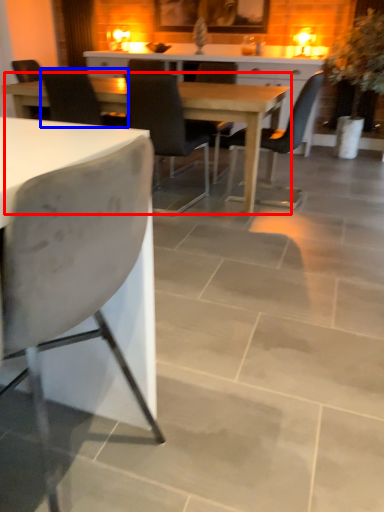
Question: Which point is further to the camera, kitchen & dining room table (highlighted by a red box) or chair (highlighted by a blue box)?

Choices:
 (A) kitchen & dining room table
 (B) chair

Answer: (B)